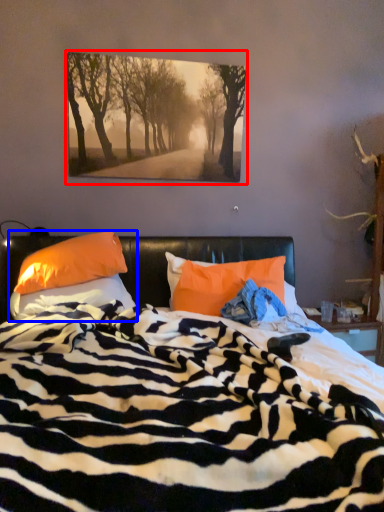
Question: Among these objects, which one is nearest to the camera, picture frame (highlighted by a red box) or pillow (highlighted by a blue box)?

Choices:
 (A) picture frame
 (B) pillow

Answer: (B)